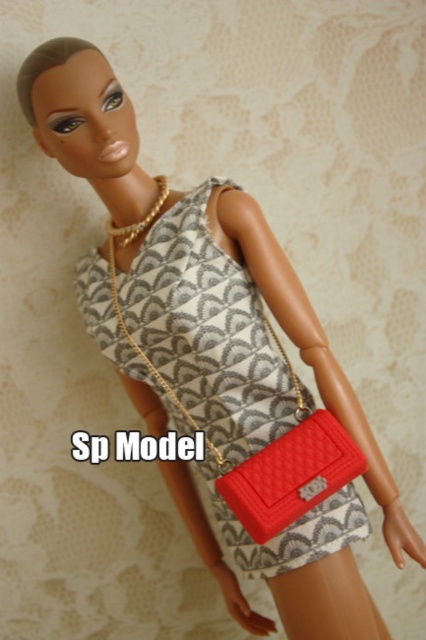
You are a fashion designer who needs to decide which item to place in a showcase. The showcase has a limited space that can only accommodate items up to the size of the smaller object. Which item should you choose between the quilted fabric dress at center and the matte red clutch at lower right?

The matte red clutch at lower right is smaller in size than the quilted fabric dress at center, so you should choose the matte red clutch at lower right for the showcase as it fits the space constraint.

Based on the photo, you are a fashion designer observing the doll and want to adjust the placement of the accessories. Since the matte red clutch at lower right is currently positioned behind the quilted fabric dress at center, which accessory would you need to move to make the clutch visible?

The matte red clutch at lower right is behind the quilted fabric dress at center, so to make it visible, you would need to move the quilted fabric dress at center out of the way or adjust the clutch to a position in front of it.

Based on the coordinates provided in the scene, where is the quilted fabric dress at center located?

The quilted fabric dress at center is located at the 2D coordinates point (207, 330).